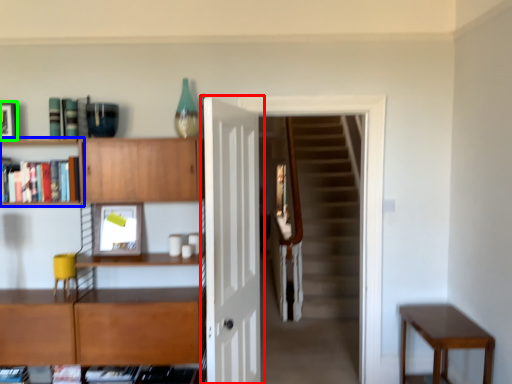
Question: Considering the real-world distances, which object is closest to door (highlighted by a red box)? shelf (highlighted by a blue box) or picture frame (highlighted by a green box).

Choices:
 (A) shelf
 (B) picture frame

Answer: (A)